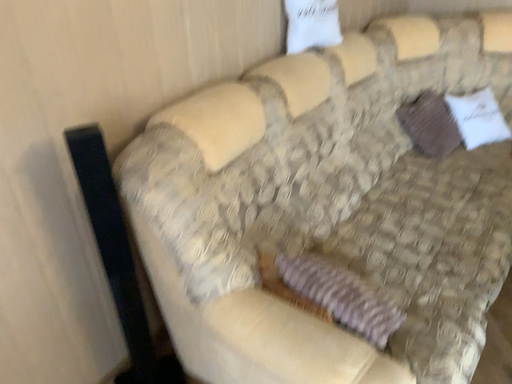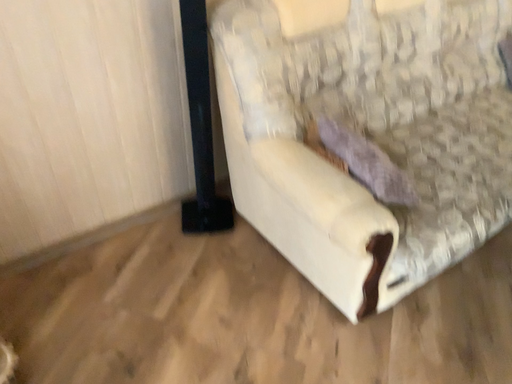
Question: Which way did the camera rotate in the video?

Choices:
 (A) rotated right
 (B) rotated left

Answer: (B)